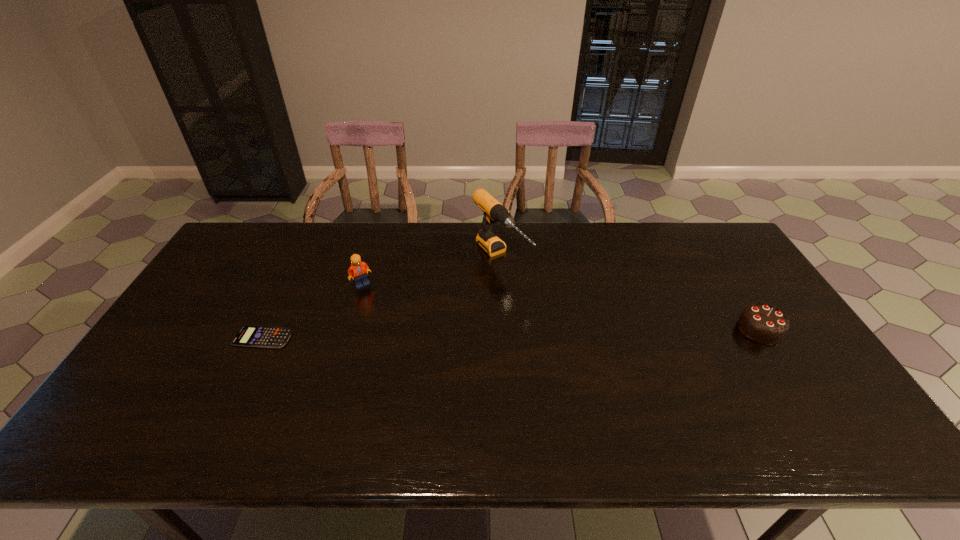
Locate an element on the screen. This screenshot has height=540, width=960. vacant space on the desktop that is between the leftmost object and the third tallest object and is positioned on the front-facing side of the Lego is located at coordinates (442, 334).

Identify the location of free spot on the desktop that is between the calculator and the second shortest object and is positioned on the handle side of the drill. Image resolution: width=960 pixels, height=540 pixels. (574, 333).